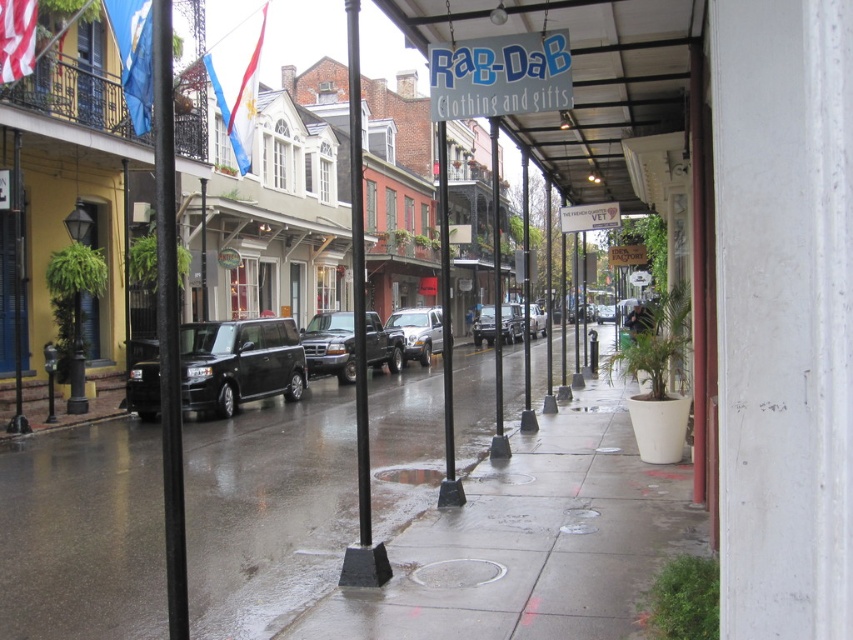
Question: Which is farther from the black metal pole at left?

Choices:
 (A) glossy concrete sidewalk at center
 (B) black plastic pole at center

Answer: (B)

Question: Which object is positioned closest to the metallic silver truck at center?

Choices:
 (A) metallic silver suv at center
 (B) black metal pole at center

Answer: (A)

Question: Does matte black truck at center appear over silver metallic truck at center?

Choices:
 (A) no
 (B) yes

Answer: (A)

Question: Which point is farther from the camera taking this photo?

Choices:
 (A) (164, 376)
 (B) (503, 336)

Answer: (B)

Question: Is black metal pole at left in front of shiny black suv at left?

Choices:
 (A) no
 (B) yes

Answer: (B)

Question: Can you confirm if black metal pole at left is positioned to the right of matte black truck at center?

Choices:
 (A) yes
 (B) no

Answer: (B)